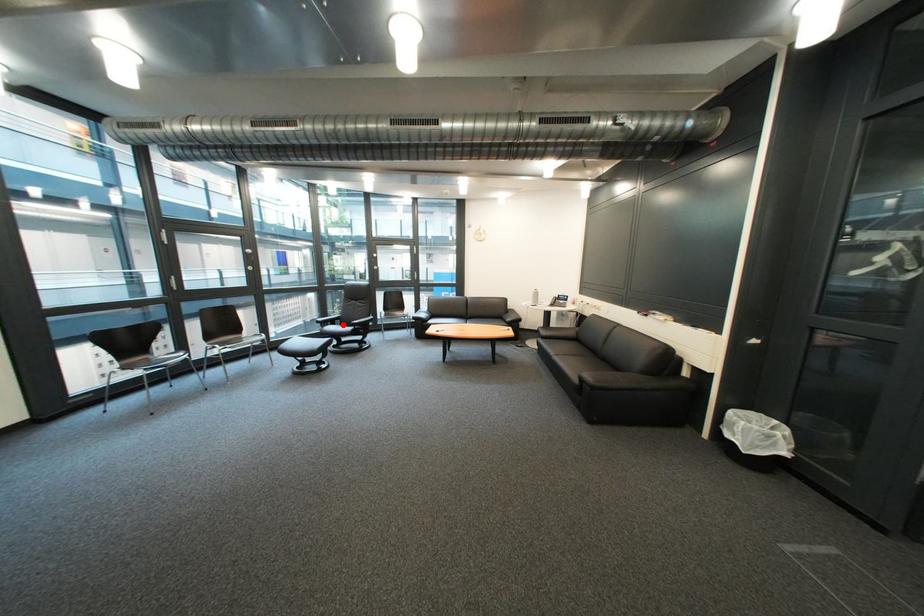
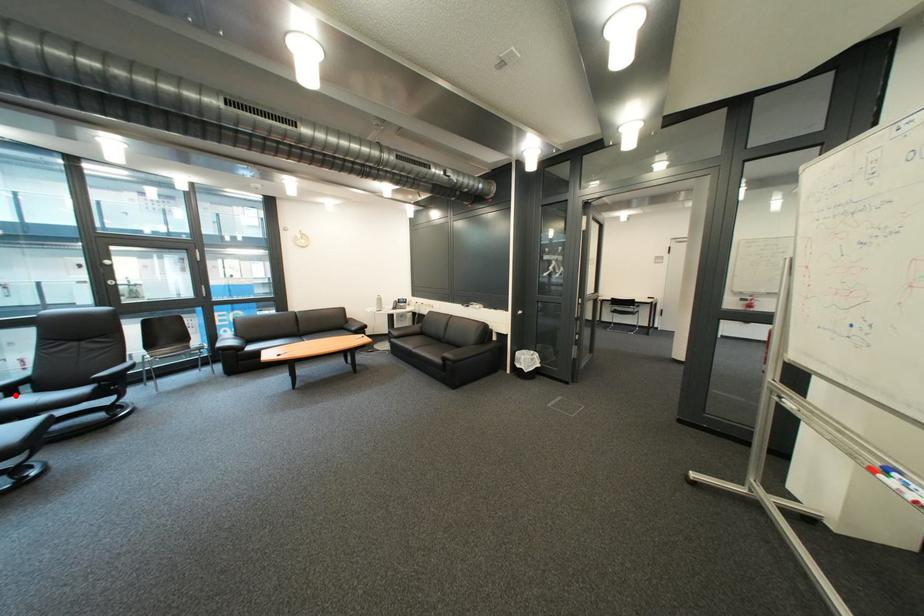
I am providing you with two images of the same scene from different viewpoints. A red point is marked on the first image and another point is marked on the second image. Is the marked point in image1 the same physical position as the marked point in image2?

Yes